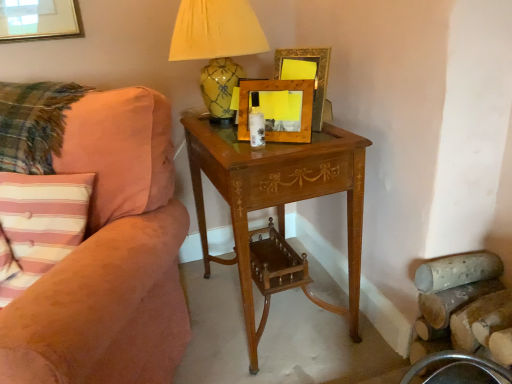
In order to click on vacant region under light brown wood nightstand at center (from a real-world perspective) in this screenshot , I will do `click(282, 316)`.